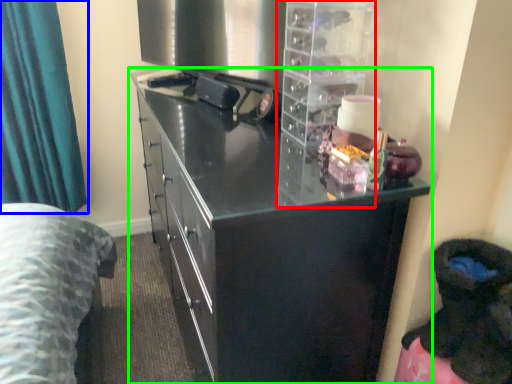
Question: Which object is positioned closest to cabinet (highlighted by a red box)? Select from curtain (highlighted by a blue box) and cupboard (highlighted by a green box).

Choices:
 (A) curtain
 (B) cupboard

Answer: (B)